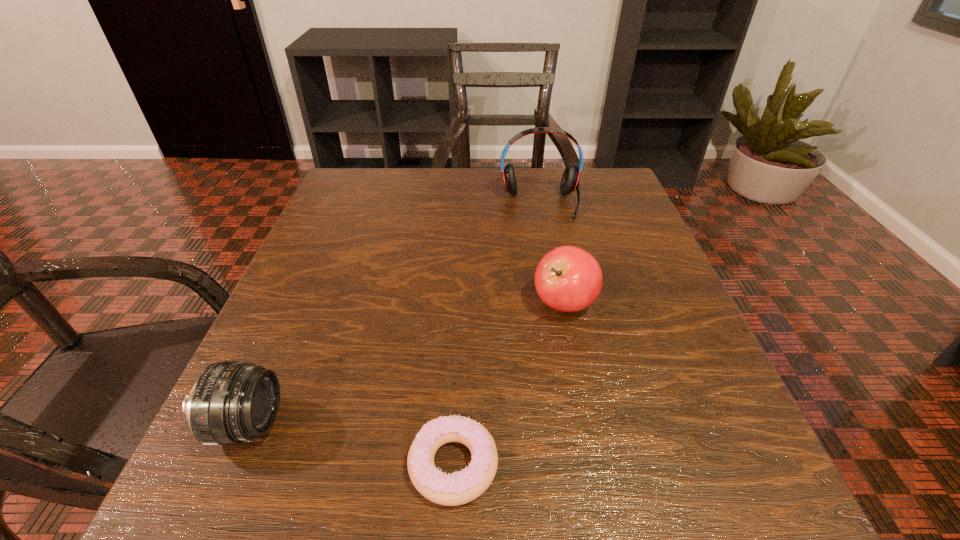
I want to click on the farthest object, so click(570, 182).

The height and width of the screenshot is (540, 960). I want to click on the tallest object, so click(x=570, y=182).

Locate an element on the screen. apple is located at coordinates (568, 279).

Locate an element on the screen. the leftmost object is located at coordinates (231, 402).

Identify the location of doughnut. coord(459,488).

I want to click on the third object from right to left, so click(x=459, y=488).

Image resolution: width=960 pixels, height=540 pixels. I want to click on vacant space located with the microphone attached to the side of the tallest object, so click(563, 319).

Where is `blank area located 0.150m on the front of the apple`? This screenshot has width=960, height=540. blank area located 0.150m on the front of the apple is located at coordinates [585, 407].

This screenshot has width=960, height=540. What are the coordinates of `vacant space located at the front element of the leftmost object` in the screenshot? It's located at (543, 424).

Locate an element on the screen. The width and height of the screenshot is (960, 540). free space located 0.310m on the back of the third object from right to left is located at coordinates (462, 275).